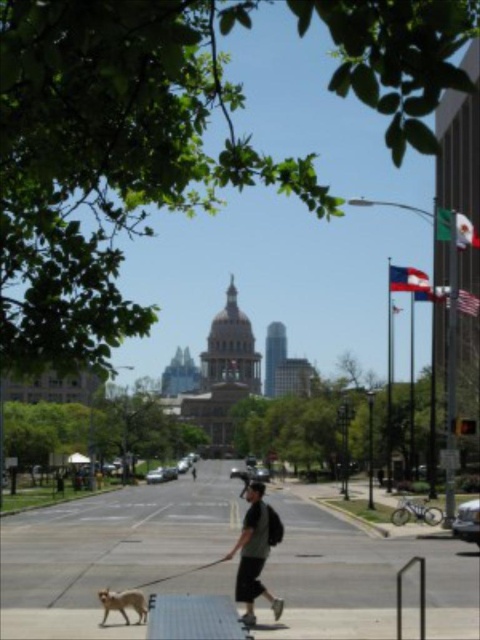
Question: Does golden fur dog at lower left appear on the right side of wooden skateboard at lower center?

Choices:
 (A) no
 (B) yes

Answer: (A)

Question: Which point is closer to the camera?

Choices:
 (A) (127, 488)
 (B) (108, 602)

Answer: (B)

Question: Which object is positioned farthest from the wooden skateboard at lower center?

Choices:
 (A) golden fur dog at lower left
 (B) smooth concrete sidewalk at center

Answer: (B)

Question: Can you confirm if smooth concrete sidewalk at center is positioned to the left of golden fur dog at lower left?

Choices:
 (A) no
 (B) yes

Answer: (B)

Question: Does smooth concrete sidewalk at center lie in front of wooden skateboard at lower center?

Choices:
 (A) yes
 (B) no

Answer: (A)

Question: Which point appears closest to the camera in this image?

Choices:
 (A) (255, 484)
 (B) (282, 628)
 (C) (235, 570)
 (D) (98, 598)

Answer: (B)